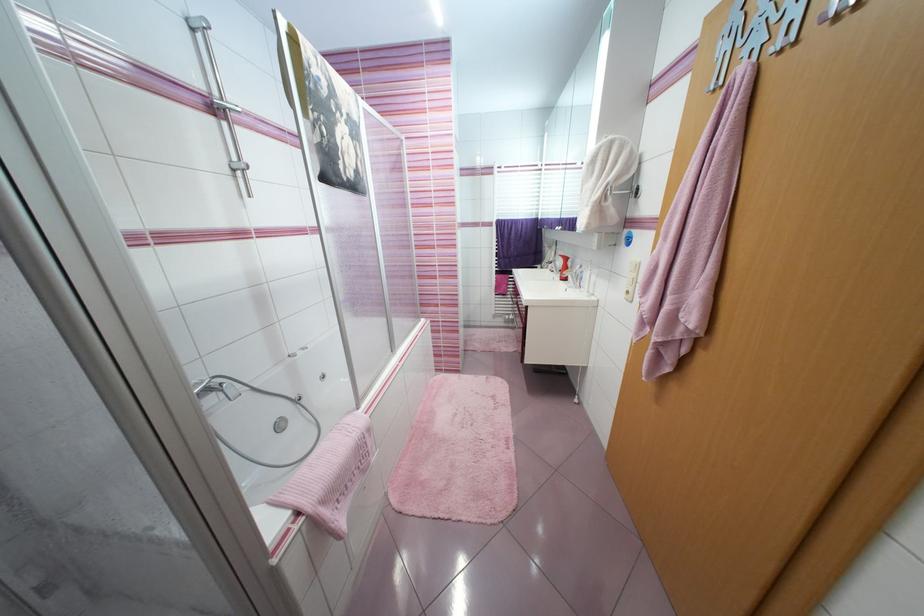
Identify the location of bathtub faucet lever. (215, 387).